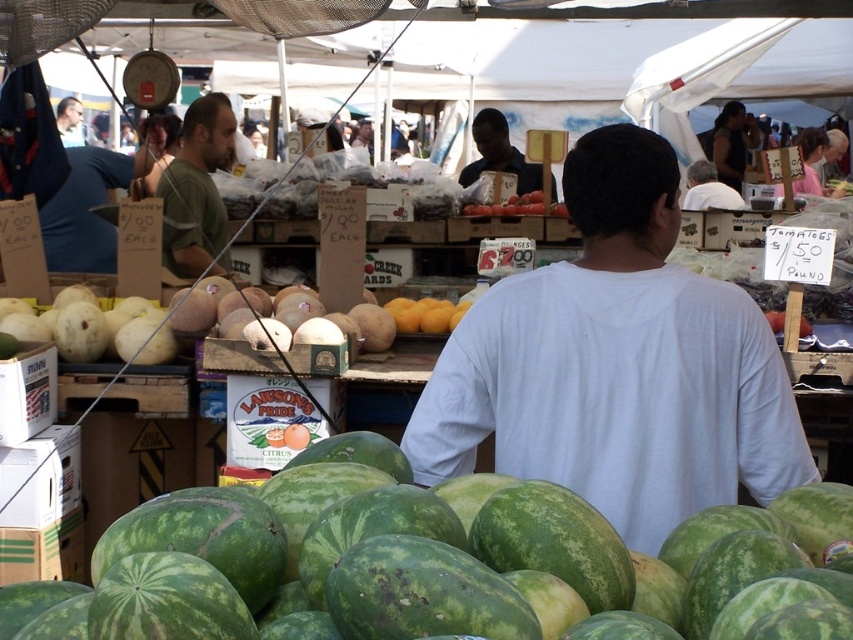
From the picture: You are a customer at the farmer market and you want to buy a shirt. You see the white cotton shirt at center and the smooth black shirt at center. Which shirt is shorter?

The white cotton shirt at center is shorter than the smooth black shirt at center.

You are a customer at the farmer market and you want to buy both the green cotton shirt at center and the yellow matte peaches at center. Which one do you need to reach for first if they are both on the same shelf?

The green cotton shirt at center is larger in size than yellow matte peaches at center, so you need to reach for the green cotton shirt at center first to avoid having to move the smaller yellow matte peaches at center out of the way.

You are standing at the entrance of the farmer market and see a person wearing a smooth black shirt at center. Where would you look to find this person in the image?

The smooth black shirt at center is located at point (498, 154) in the image, so you should look towards the center area slightly to the left and halfway down the frame to find the person wearing it.